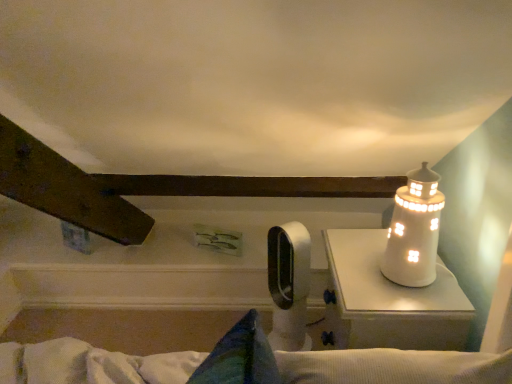
Locate an element on the screen. free space in front of white ceramic lighthouse at upper right is located at coordinates (413, 306).